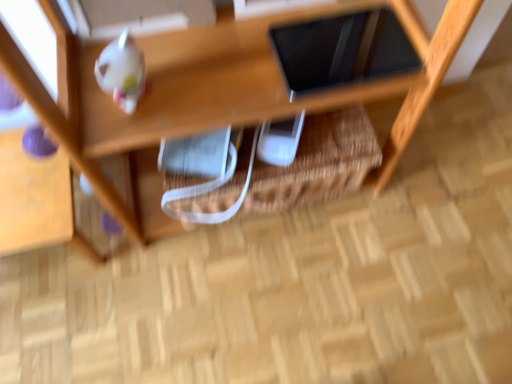
Question: Is black glossy tablet at upper center positioned beyond the bounds of white glossy teapot at upper left?

Choices:
 (A) no
 (B) yes

Answer: (B)

Question: Is black glossy tablet at upper center at the right side of white glossy teapot at upper left?

Choices:
 (A) yes
 (B) no

Answer: (A)

Question: From a real-world perspective, does black glossy tablet at upper center sit lower than white glossy teapot at upper left?

Choices:
 (A) no
 (B) yes

Answer: (B)

Question: Does black glossy tablet at upper center have a greater width compared to white glossy teapot at upper left?

Choices:
 (A) yes
 (B) no

Answer: (A)

Question: Is black glossy tablet at upper center positioned in front of white glossy teapot at upper left?

Choices:
 (A) yes
 (B) no

Answer: (B)

Question: From the image's perspective, is wooden shelf at upper center positioned above or below white glossy teapot at upper left?

Choices:
 (A) below
 (B) above

Answer: (A)

Question: Considering the positions of wooden shelf at upper center and white glossy teapot at upper left in the image, is wooden shelf at upper center taller or shorter than white glossy teapot at upper left?

Choices:
 (A) tall
 (B) short

Answer: (B)

Question: Is point (208, 120) closer or farther from the camera than point (110, 64)?

Choices:
 (A) farther
 (B) closer

Answer: (A)

Question: Relative to white glossy teapot at upper left, is wooden shelf at upper center in front or behind?

Choices:
 (A) front
 (B) behind

Answer: (B)

Question: Looking at their shapes, would you say white glossy teapot at upper left is wider or thinner than black glossy tablet at upper center?

Choices:
 (A) wide
 (B) thin

Answer: (B)

Question: From a real-world perspective, is white glossy teapot at upper left above or below black glossy tablet at upper center?

Choices:
 (A) below
 (B) above

Answer: (B)

Question: Based on their sizes in the image, would you say white glossy teapot at upper left is bigger or smaller than black glossy tablet at upper center?

Choices:
 (A) small
 (B) big

Answer: (A)

Question: Is point (138, 72) positioned closer to the camera than point (326, 77)?

Choices:
 (A) closer
 (B) farther

Answer: (A)

Question: Based on their sizes in the image, would you say woven straw basket at center is bigger or smaller than wooden shelf at upper center?

Choices:
 (A) big
 (B) small

Answer: (A)

Question: Considering the positions of woven straw basket at center and wooden shelf at upper center in the image, is woven straw basket at center wider or thinner than wooden shelf at upper center?

Choices:
 (A) thin
 (B) wide

Answer: (A)